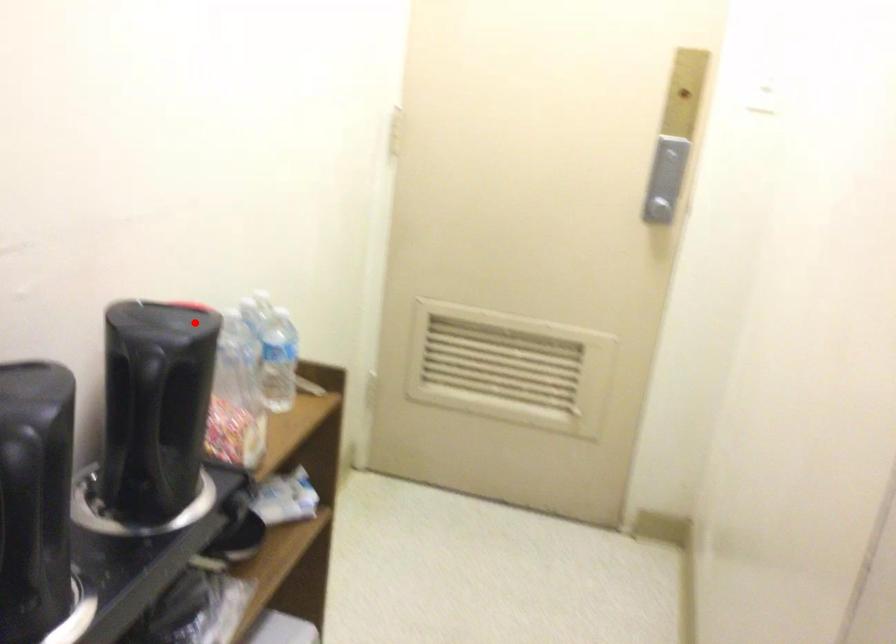
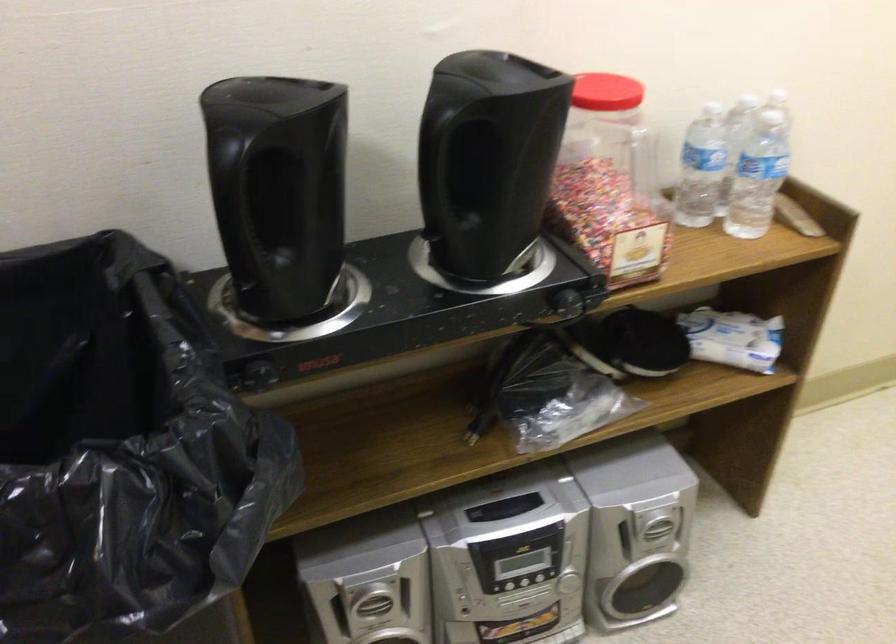
Where in the second image is the point corresponding to the highlighted location from the first image?

(606, 91)